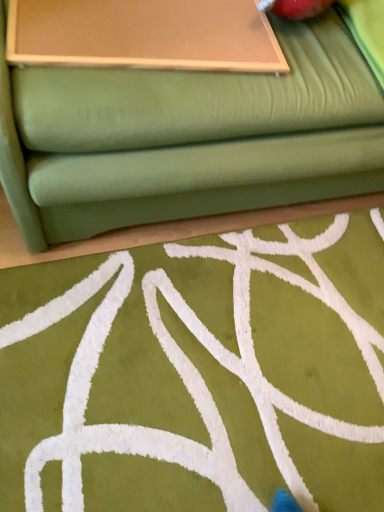
Question: Can you confirm if green fabric studio couch at upper center is bigger than matte brown board at upper center?

Choices:
 (A) no
 (B) yes

Answer: (B)

Question: Considering the relative positions of green fabric studio couch at upper center and matte brown board at upper center in the image provided, is green fabric studio couch at upper center to the left of matte brown board at upper center from the viewer's perspective?

Choices:
 (A) yes
 (B) no

Answer: (B)

Question: Considering the relative sizes of green fabric studio couch at upper center and matte brown board at upper center in the image provided, is green fabric studio couch at upper center wider than matte brown board at upper center?

Choices:
 (A) yes
 (B) no

Answer: (A)

Question: Can you confirm if green fabric studio couch at upper center is shorter than matte brown board at upper center?

Choices:
 (A) yes
 (B) no

Answer: (B)

Question: Considering the relative positions of green fabric studio couch at upper center and matte brown board at upper center in the image provided, is green fabric studio couch at upper center in front of matte brown board at upper center?

Choices:
 (A) no
 (B) yes

Answer: (B)

Question: From a real-world perspective, is green fabric studio couch at upper center physically above matte brown board at upper center?

Choices:
 (A) no
 (B) yes

Answer: (A)

Question: Does matte brown board at upper center have a greater width compared to green fabric studio couch at upper center?

Choices:
 (A) no
 (B) yes

Answer: (A)

Question: Is green fabric studio couch at upper center at the back of matte brown board at upper center?

Choices:
 (A) yes
 (B) no

Answer: (A)

Question: Is matte brown board at upper center far away from green fabric studio couch at upper center?

Choices:
 (A) yes
 (B) no

Answer: (B)

Question: Does matte brown board at upper center have a larger size compared to green fabric studio couch at upper center?

Choices:
 (A) yes
 (B) no

Answer: (B)

Question: Does matte brown board at upper center contain green fabric studio couch at upper center?

Choices:
 (A) yes
 (B) no

Answer: (B)

Question: Considering the relative positions of matte brown board at upper center and green fabric studio couch at upper center in the image provided, is matte brown board at upper center in front of green fabric studio couch at upper center?

Choices:
 (A) no
 (B) yes

Answer: (A)

Question: From their relative heights in the image, would you say green fabric studio couch at upper center is taller or shorter than matte brown board at upper center?

Choices:
 (A) tall
 (B) short

Answer: (A)